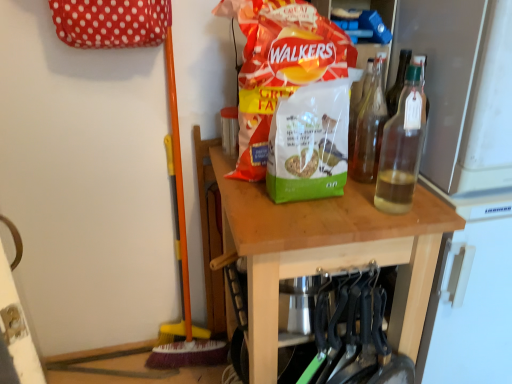
Locate an element on the screen. Image resolution: width=512 pixels, height=384 pixels. free location to the right of green matte birdseed bag at center, the 1th waste positioned from the bottom is located at coordinates (368, 198).